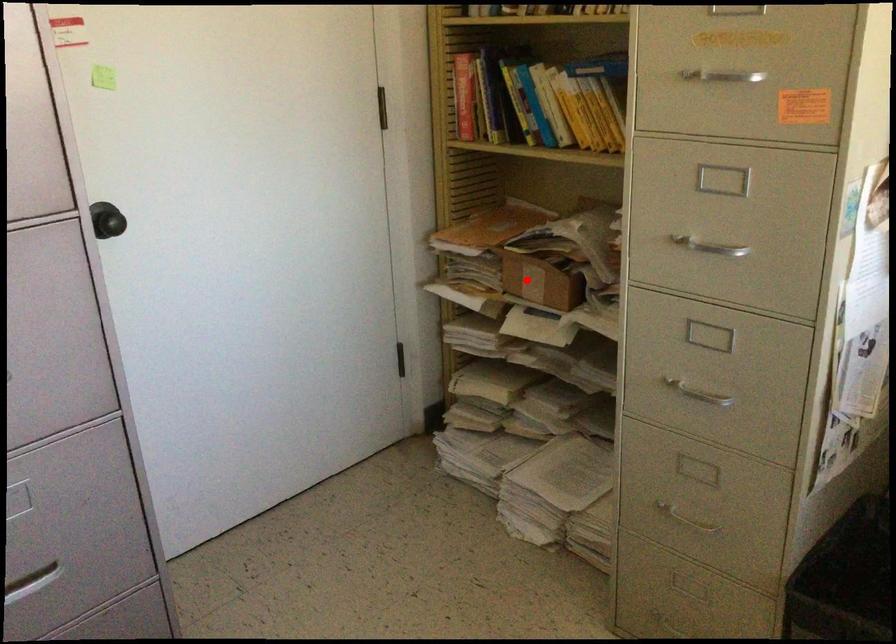
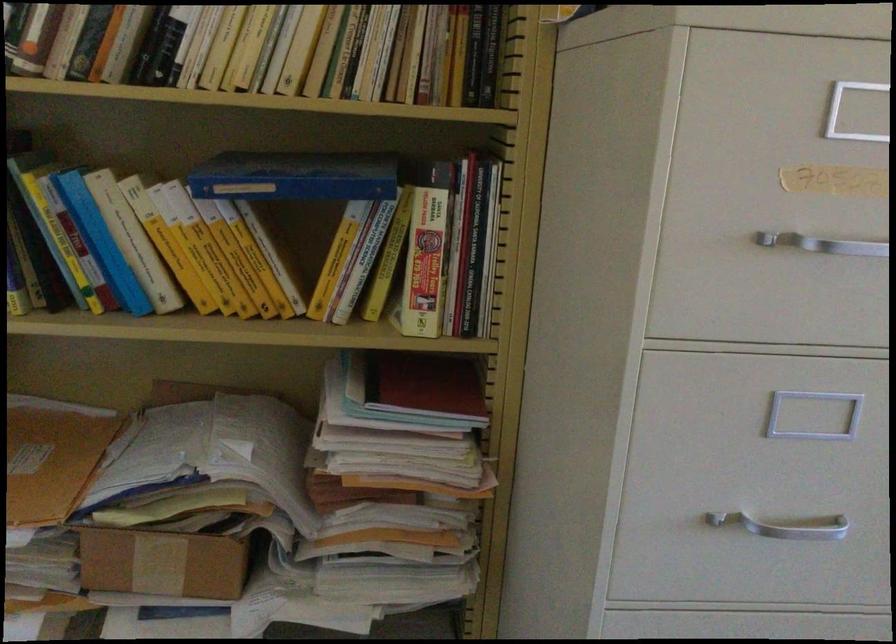
Locate, in the second image, the point that corresponds to the highlighted location in the first image.

(161, 564)